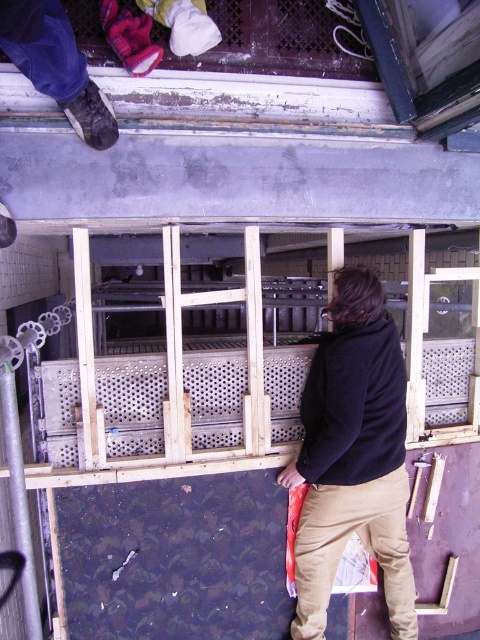
Question: Which point appears closest to the camera in this image?

Choices:
 (A) (367, 102)
 (B) (403, 417)
 (C) (402, 452)

Answer: (A)

Question: Can you confirm if black fleece jacket at center is thinner than black fleece sweatshirt at center?

Choices:
 (A) yes
 (B) no

Answer: (B)

Question: Which of the following is the closest to the observer?

Choices:
 (A) (383, 77)
 (B) (319, 472)
 (C) (327, 353)

Answer: (A)

Question: Which object is positioned closest to the black fleece jacket at center?

Choices:
 (A) black fleece sweatshirt at center
 (B) wooden frame at upper center

Answer: (A)

Question: Is black fleece jacket at center to the left of black fleece sweatshirt at center from the viewer's perspective?

Choices:
 (A) no
 (B) yes

Answer: (B)

Question: Is wooden frame at upper center smaller than black fleece sweatshirt at center?

Choices:
 (A) yes
 (B) no

Answer: (B)